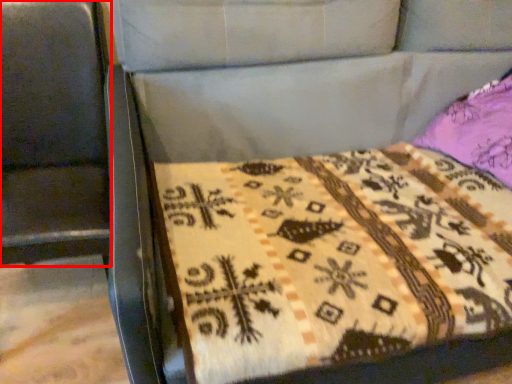
Question: From the image, what is the correct spatial relationship of swivel chair (annotated by the red box) in relation to quilt?

Choices:
 (A) right
 (B) left

Answer: (B)